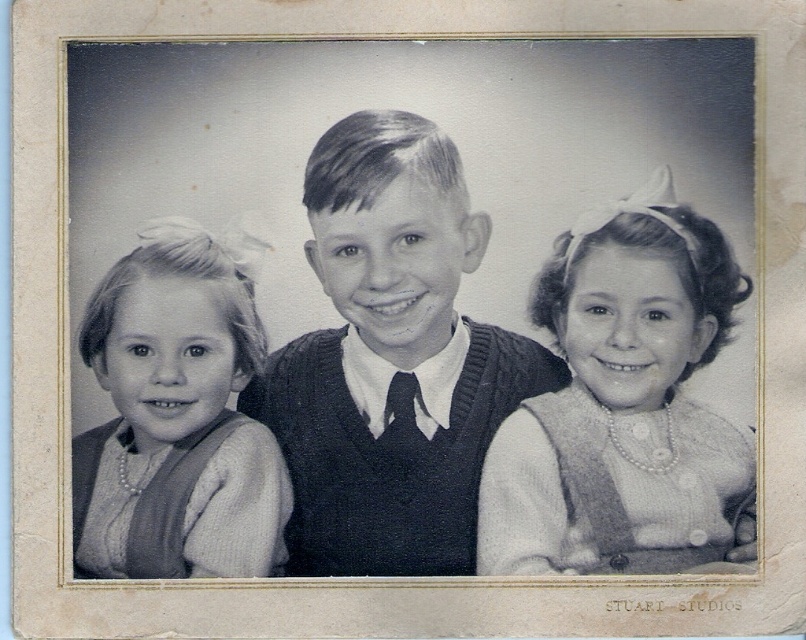
Question: Can you confirm if knitted sweater at center is positioned to the left of black silk tie at center?

Choices:
 (A) yes
 (B) no

Answer: (B)

Question: Among these points, which one is farthest from the camera?

Choices:
 (A) (393, 428)
 (B) (331, 404)
 (C) (248, 492)
 (D) (613, 216)

Answer: (B)

Question: Based on their relative distances, which object is farther from the matte white sweater at left?

Choices:
 (A) pearl necklace at center
 (B) knitted sweater at center

Answer: (A)

Question: Can you confirm if knitted sweater at center is smaller than black silk tie at center?

Choices:
 (A) yes
 (B) no

Answer: (B)

Question: Which object is the farthest from the matte white sweater at left?

Choices:
 (A) black silk tie at center
 (B) knitted sweater at center
 (C) pearl necklace at center

Answer: (C)

Question: From the image, what is the correct spatial relationship of knitted sweater at center in relation to matte white sweater at left?

Choices:
 (A) above
 (B) below

Answer: (A)